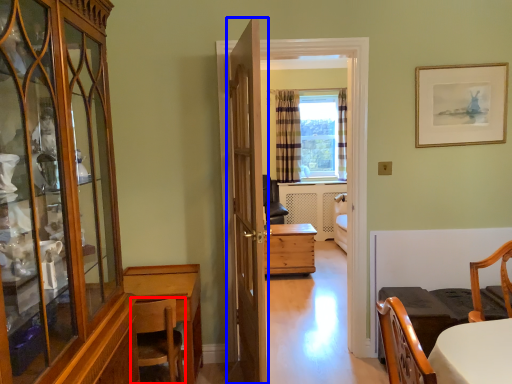
Question: Which object appears farthest to the camera in this image, chair (highlighted by a red box) or door (highlighted by a blue box)?

Choices:
 (A) chair
 (B) door

Answer: (A)